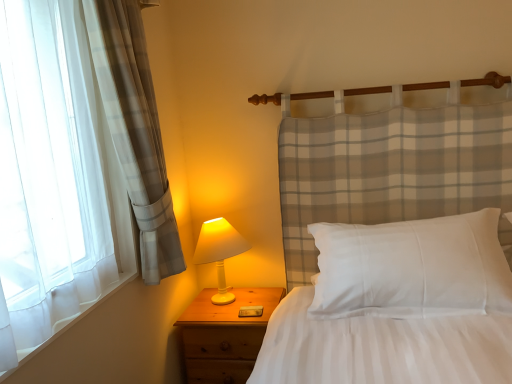
Question: Does point (460, 297) appear closer or farther from the camera than point (207, 251)?

Choices:
 (A) closer
 (B) farther

Answer: (A)

Question: From the image's perspective, is white cotton pillow at center positioned above or below white matte table lamp at lower left?

Choices:
 (A) below
 (B) above

Answer: (B)

Question: Which object is positioned closest to the white matte table lamp at lower left?

Choices:
 (A) wooden nightstand at lower left
 (B) white cotton pillow at center

Answer: (A)

Question: Based on their relative distances, which object is nearer to the white cotton pillow at center?

Choices:
 (A) wooden nightstand at lower left
 (B) white matte table lamp at lower left

Answer: (A)